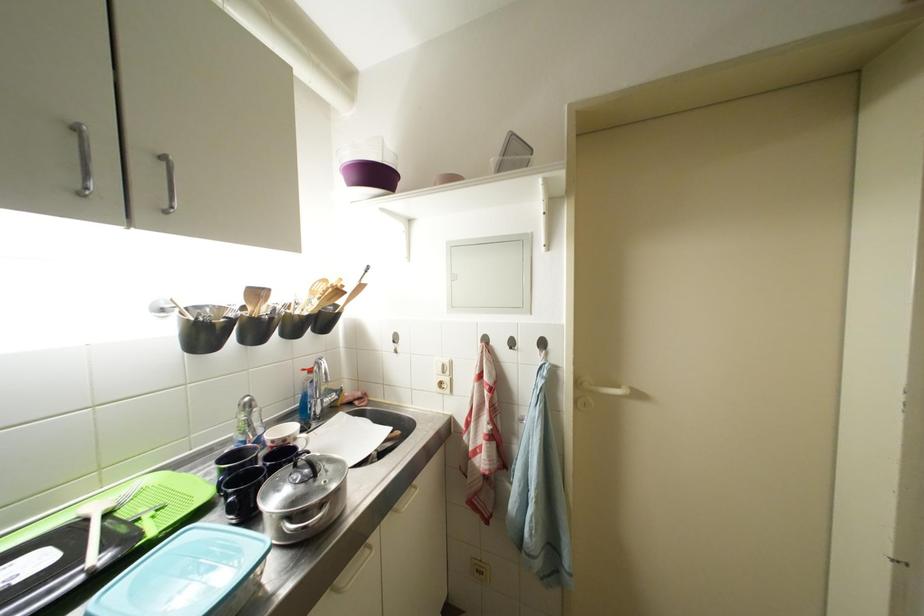
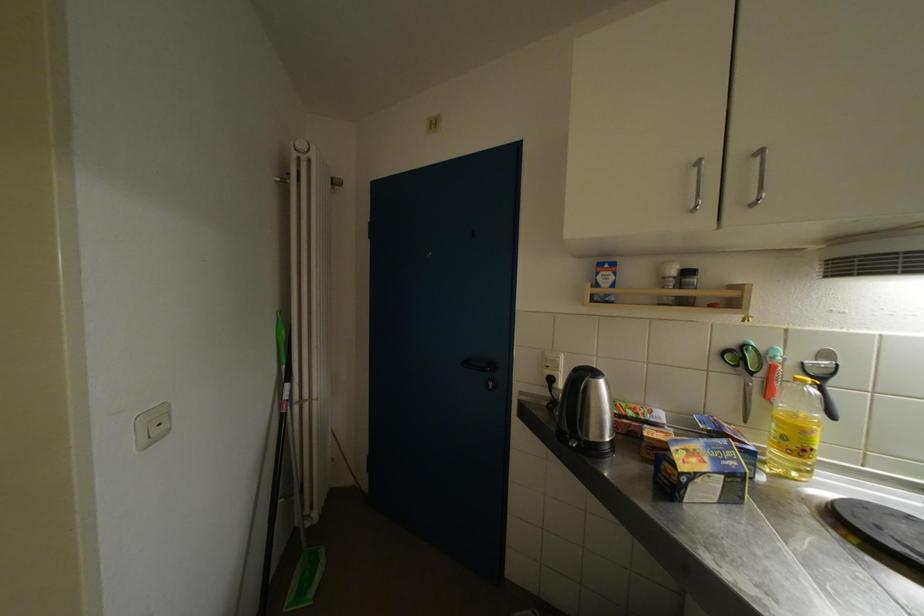
Question: The first image is from the beginning of the video and the second image is from the end. How did the camera likely rotate when shooting the video?

Choices:
 (A) Left
 (B) Right
 (C) Up
 (D) Down

Answer: (A)